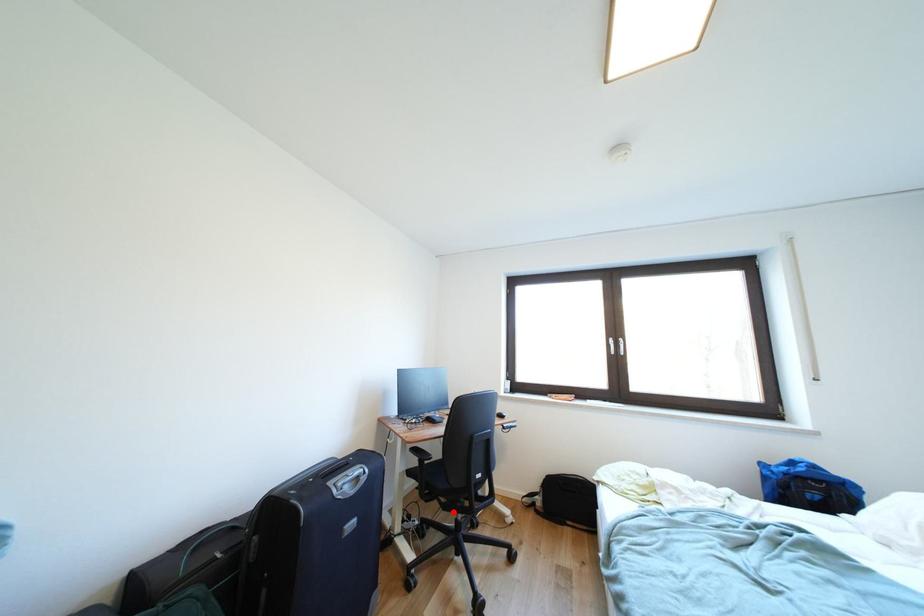
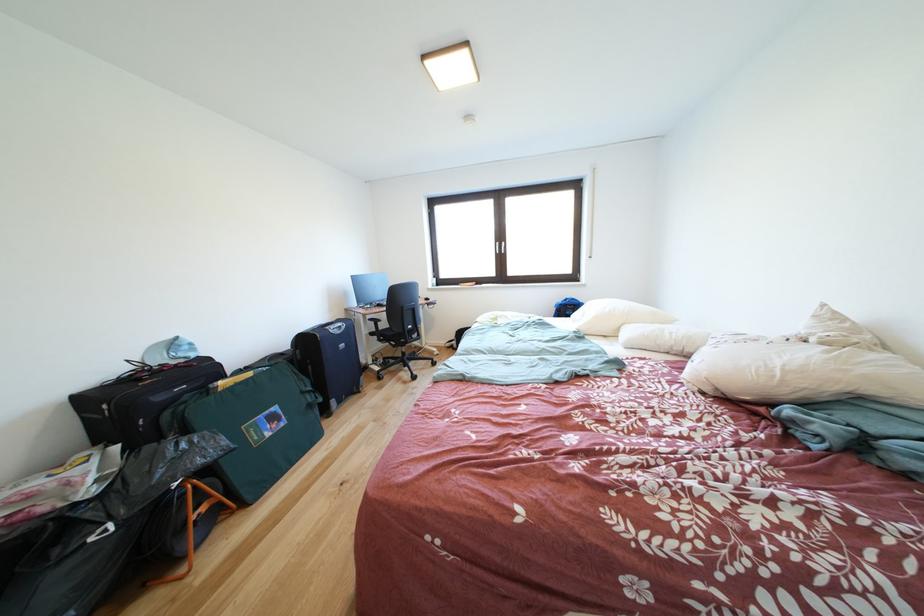
In the second image, find the point that corresponds to the highlighted location in the first image.

(403, 351)